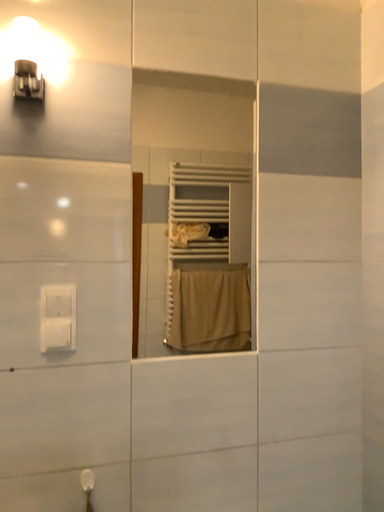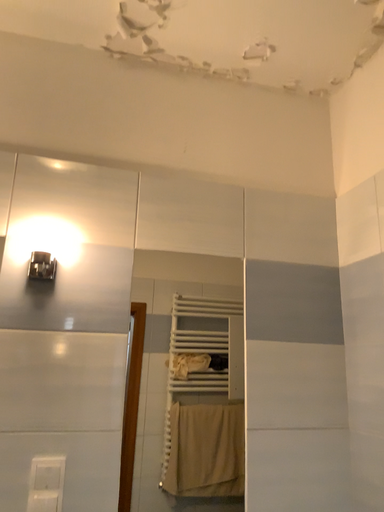
Question: Which way did the camera rotate in the video?

Choices:
 (A) rotated downward
 (B) rotated upward

Answer: (B)